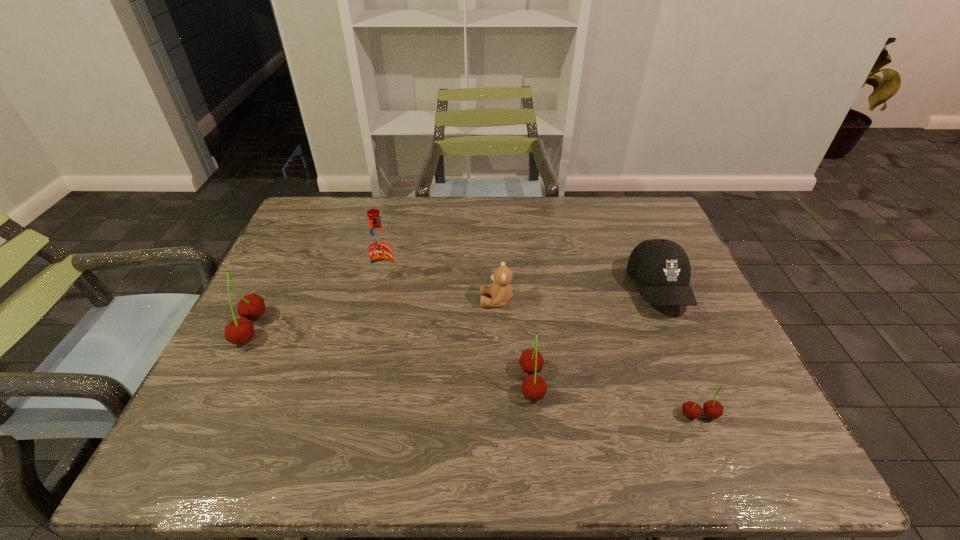
Find the location of a particular element. spot to insert another cherry for uniform distribution is located at coordinates (383, 354).